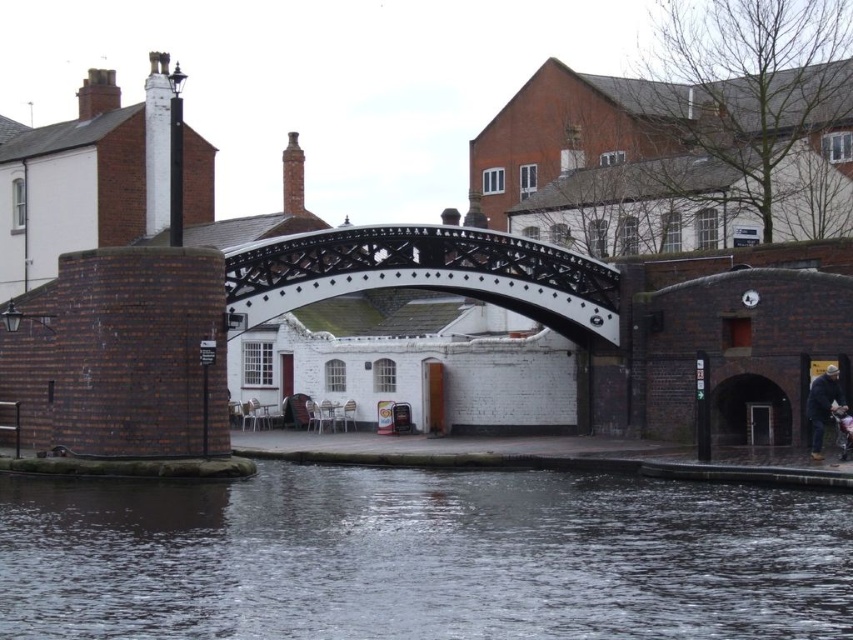
You are standing at the black metal bridge in the canal scene. You notice two points marked in the image. Which point, point (590, 636) or point (811, 451), is closer to you?

Point (590, 636) is closer to the viewer than point (811, 451).

You are a delivery person carrying a package and need to cross the canal shown in the image. You see the brown water at lower center and the dark blue jacket at lower right. Which object can you step onto to safely cross the canal?

The dark blue jacket at lower right is not a structure you can step onto. The brown water at lower center is part of the canal itself and cannot be stepped on safely. However, the scene description mentions a black metal bridge arching over the water, which is the safe path to cross the canal.

From the picture: You are standing on the canal bank and see the black polished wood bridge at center and the dark blue jacket at lower right. Which object is higher in elevation?

The black polished wood bridge at center is above the dark blue jacket at lower right, so the bridge is higher in elevation.